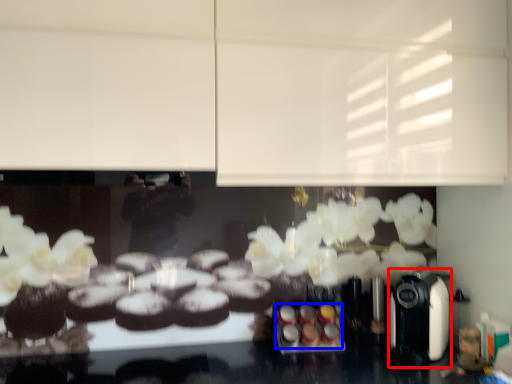
Question: Which point is further to the camera, coffee machine (highlighted by a red box) or food (highlighted by a blue box)?

Choices:
 (A) coffee machine
 (B) food

Answer: (B)